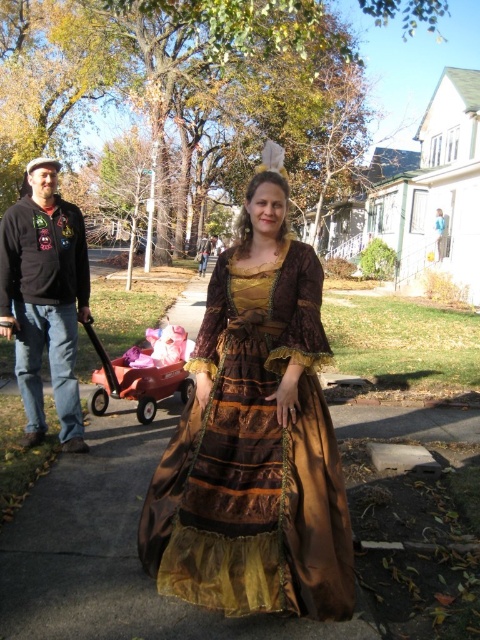
Which of these two, shiny brown fabric dress at center or orange plastic wagon at lower left, stands shorter?

With less height is orange plastic wagon at lower left.

Is shiny brown fabric dress at center to the left of orange plastic wagon at lower left from the viewer's perspective?

In fact, shiny brown fabric dress at center is to the right of orange plastic wagon at lower left.

Is point (296, 326) in front of point (187, 385)?

Yes, it is.

Where is `shiny brown fabric dress at center`? shiny brown fabric dress at center is located at coordinates (253, 458).

Is matte black jacket at left thinner than orange plastic wagon at lower left?

Correct, matte black jacket at left's width is less than orange plastic wagon at lower left's.

Between point (21, 362) and point (167, 380), which one is positioned behind?

The point (167, 380) is behind.

Where is `matte black jacket at left`? matte black jacket at left is located at coordinates (45, 300).

Who is shorter, shiny brown fabric dress at center or matte black jacket at left?

With less height is shiny brown fabric dress at center.

Where is `shiny brown fabric dress at center`? shiny brown fabric dress at center is located at coordinates (253, 458).

The width and height of the screenshot is (480, 640). What do you see at coordinates (253, 458) in the screenshot?
I see `shiny brown fabric dress at center` at bounding box center [253, 458].

Where is `shiny brown fabric dress at center`? Image resolution: width=480 pixels, height=640 pixels. shiny brown fabric dress at center is located at coordinates (253, 458).